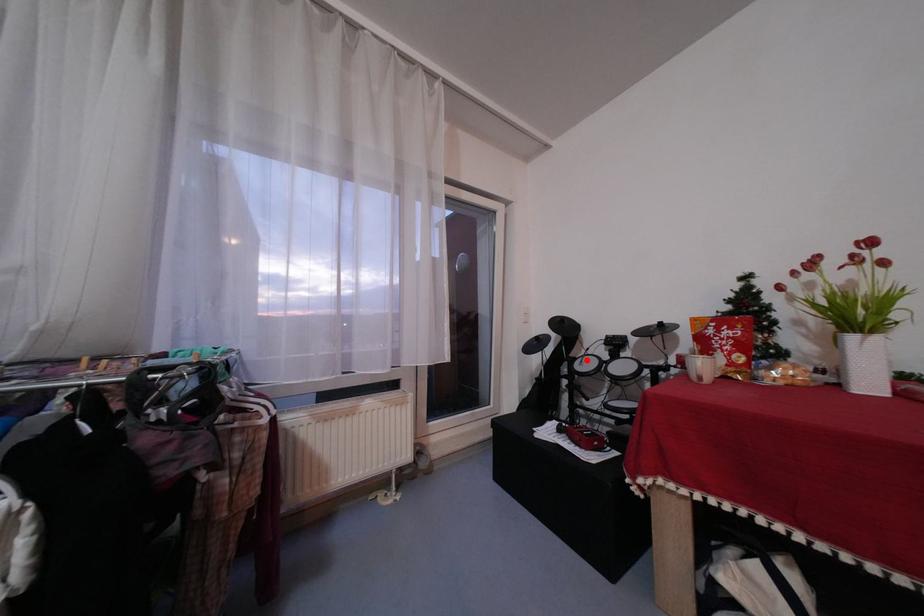
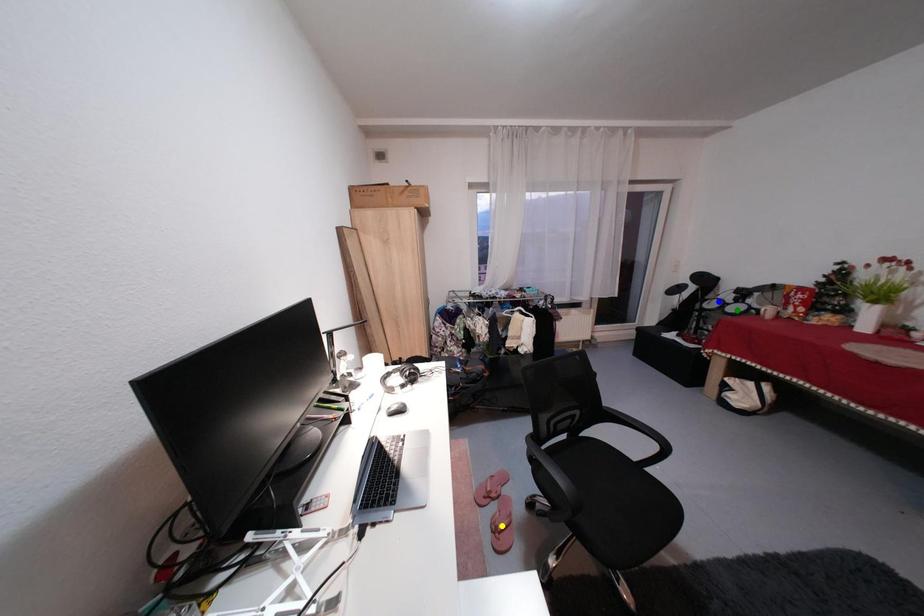
Question: I am providing you with two images of the same scene from different viewpoints. A red point is marked on the first image. You are given multiple points on the second image. Which point in image 2 is actually the same real-world point as the red point in image 1?

Choices:
 (A) yellow point
 (B) green point
 (C) blue point

Answer: (C)